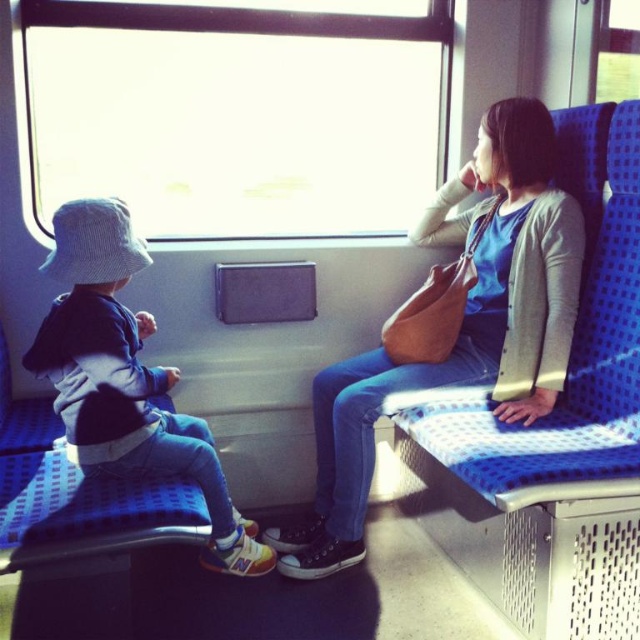
You are standing at the point marked as point(236, 115) in the train carriage. What object is located exactly at this point?

The transparent glass window at upper center is located exactly at point(236, 115).

You are a passenger on a train and need to place your matte brown purse at center on top of the denim pants at left. Is this possible based on their sizes?

Answer: The matte brown purse at center is taller than denim pants at left, so placing the matte brown purse at center on top of the denim pants at left may not be possible due to the purse being taller and potentially larger in size.

You are a traveler who needs to place a 60 cm long item between the matte brown purse at center and the denim pants at left. Is there enough space?

The distance between the matte brown purse at center and the denim pants at left is 70.19 centimeters, which is more than enough to accommodate a 60 cm long item.